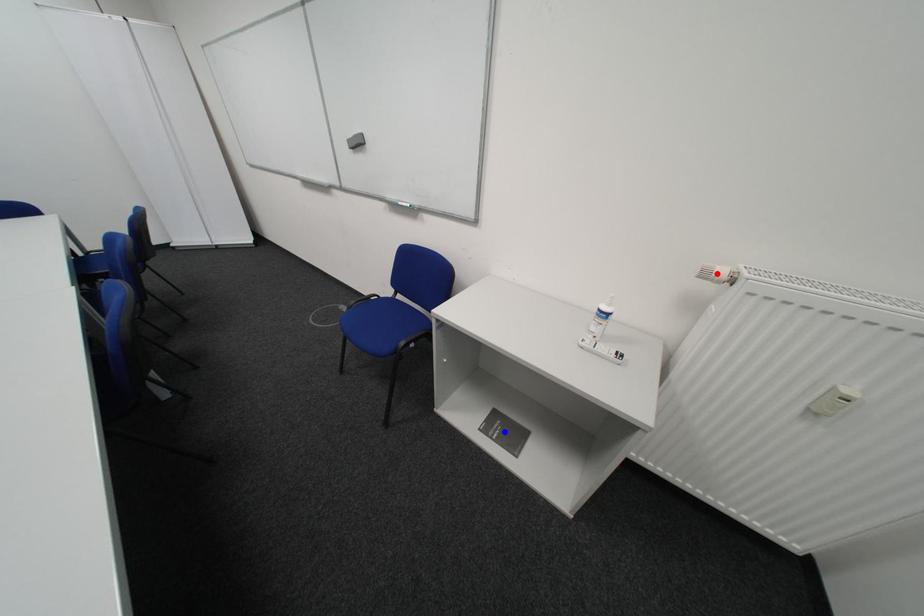
Question: In the image, two points are highlighted. Which point is nearer to the camera? Reply with the corresponding letter.

Choices:
 (A) blue point
 (B) red point

Answer: (B)